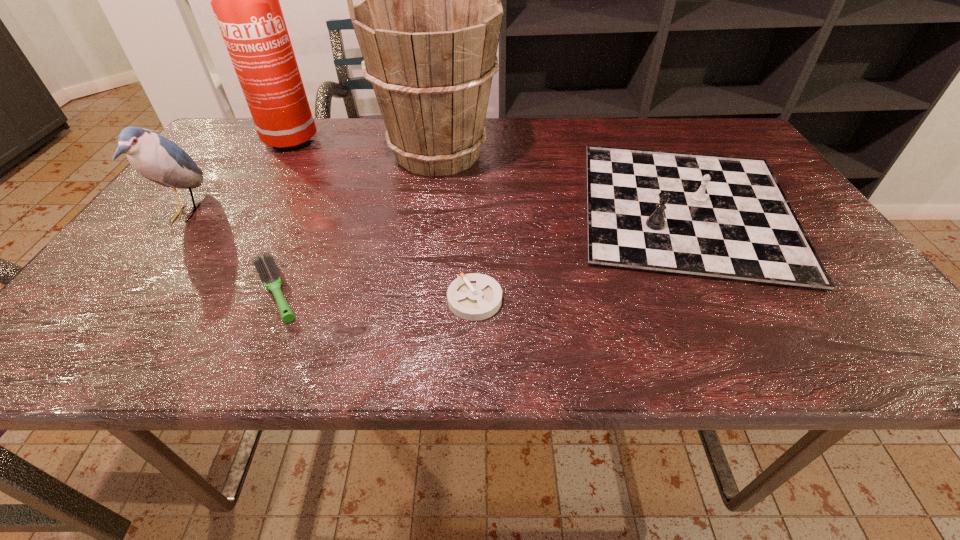
Find the location of a particular element. unoccupied position between the gameboard and the fire extinguisher is located at coordinates (483, 174).

Locate an element on the screen. vacant space that's between the gameboard and the bird is located at coordinates (437, 211).

Where is `vacant point located between the third shortest object and the fire extinguisher`? This screenshot has width=960, height=540. vacant point located between the third shortest object and the fire extinguisher is located at coordinates (483, 174).

The height and width of the screenshot is (540, 960). In order to click on empty location between the fourth object from right to left and the third shortest object in this screenshot , I will do tap(481, 250).

This screenshot has height=540, width=960. Identify the location of unoccupied position between the fire extinguisher and the shortest object. (377, 220).

Where is `free space between the hairbrush and the fire extinguisher`? free space between the hairbrush and the fire extinguisher is located at coordinates (277, 215).

Locate an element on the screen. Image resolution: width=960 pixels, height=540 pixels. free space between the third tallest object and the hairbrush is located at coordinates (231, 252).

Identify which object is the second closest to the hairbrush. Please provide its 2D coordinates. Your answer should be formatted as a tuple, i.e. [(x, y)], where the tuple contains the x and y coordinates of a point satisfying the conditions above.

[(428, 24)]

Choose which object is the second nearest neighbor to the rightmost object. Please provide its 2D coordinates. Your answer should be formatted as a tuple, i.e. [(x, y)], where the tuple contains the x and y coordinates of a point satisfying the conditions above.

[(474, 296)]

I want to click on vacant space that satisfies the following two spatial constraints: 1. on the front side of the fifth shortest object; 2. at the tip of the fourth shortest object's beak, so click(429, 213).